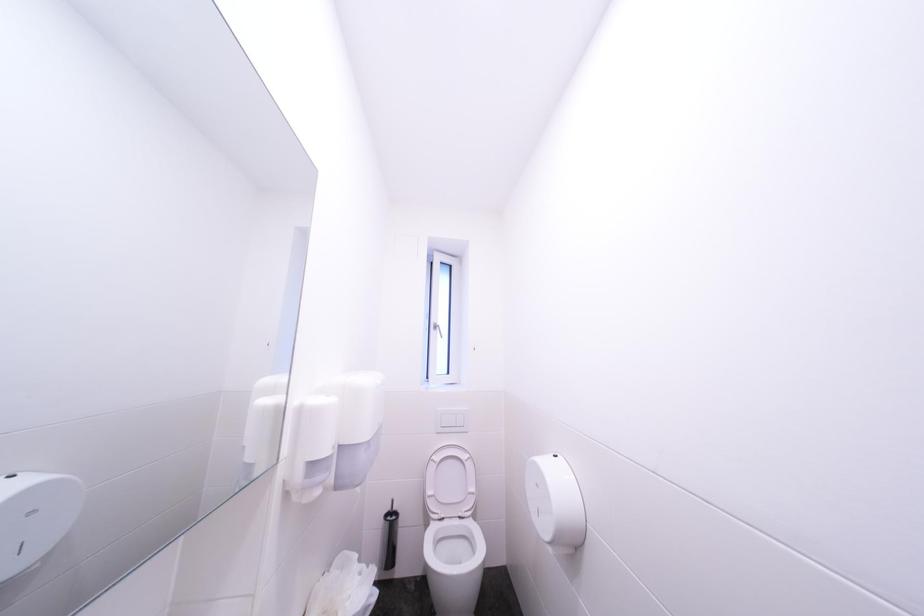
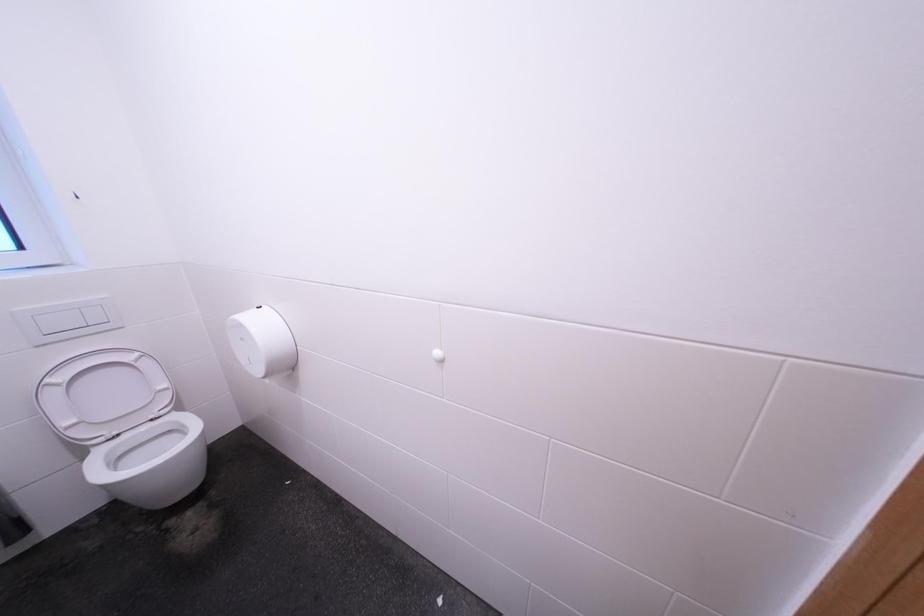
First-person continuous shooting, in which direction is the camera rotating?

The rotation direction of the camera is right-down.